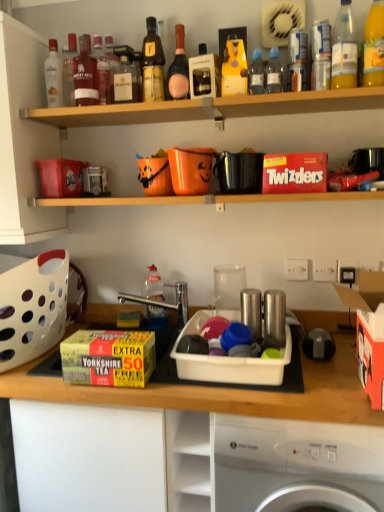
Question: Is translucent plastic bottle at upper right, the 12th bottle when ordered from left to right, to the right of yellow plastic bottle at upper center, the sixth bottle positioned from the right, from the viewer's perspective?

Choices:
 (A) no
 (B) yes

Answer: (B)

Question: Is translucent plastic bottle at upper right, the 12th bottle when ordered from left to right, positioned in front of yellow plastic bottle at upper center, the sixth bottle positioned from the right?

Choices:
 (A) yes
 (B) no

Answer: (A)

Question: From a real-world perspective, is translucent plastic bottle at upper right, which is the first bottle in right-to-left order, on yellow plastic bottle at upper center, arranged as the 7th bottle when viewed from the left?

Choices:
 (A) yes
 (B) no

Answer: (A)

Question: Does translucent plastic bottle at upper right, the 12th bottle when ordered from left to right, have a larger size compared to yellow plastic bottle at upper center, the sixth bottle positioned from the right?

Choices:
 (A) no
 (B) yes

Answer: (A)

Question: Does translucent plastic bottle at upper right, the 12th bottle when ordered from left to right, have a greater width compared to yellow plastic bottle at upper center, the sixth bottle positioned from the right?

Choices:
 (A) yes
 (B) no

Answer: (B)

Question: Can you confirm if translucent plastic bottle at upper right, which is the first bottle in right-to-left order, is thinner than yellow plastic bottle at upper center, arranged as the 7th bottle when viewed from the left?

Choices:
 (A) no
 (B) yes

Answer: (B)

Question: Can you confirm if matte plastic box at left, acting as the third box starting from the front, is thinner than clear plastic bottle at upper right, the second bottle in the right-to-left sequence?

Choices:
 (A) yes
 (B) no

Answer: (B)

Question: Can you confirm if matte plastic box at left, placed as the 3th box when sorted from right to left, is positioned to the left of clear plastic bottle at upper right, the second bottle in the right-to-left sequence?

Choices:
 (A) no
 (B) yes

Answer: (B)

Question: From the image's perspective, would you say matte plastic box at left, which is counted as the first box, starting from the top, is positioned over clear plastic bottle at upper right, the second bottle in the right-to-left sequence?

Choices:
 (A) yes
 (B) no

Answer: (B)

Question: From a real-world perspective, does matte plastic box at left, placed as the 3th box when sorted from right to left, stand above clear plastic bottle at upper right, the eleventh bottle viewed from the left?

Choices:
 (A) yes
 (B) no

Answer: (B)

Question: Considering the relative positions of matte plastic box at left, which is counted as the first box, starting from the top, and clear plastic bottle at upper right, the second bottle in the right-to-left sequence, in the image provided, is matte plastic box at left, which is counted as the first box, starting from the top, behind clear plastic bottle at upper right, the second bottle in the right-to-left sequence,?

Choices:
 (A) yes
 (B) no

Answer: (A)

Question: Does matte plastic box at left, which is counted as the first box, starting from the top, have a greater width compared to clear plastic bottle at upper right, the second bottle in the right-to-left sequence?

Choices:
 (A) yes
 (B) no

Answer: (A)

Question: Considering the relative sizes of pink glass bottle at upper center, arranged as the seventh bottle when viewed from the right, and translucent plastic bottle at upper right, the 12th bottle when ordered from left to right, in the image provided, is pink glass bottle at upper center, arranged as the seventh bottle when viewed from the right, smaller than translucent plastic bottle at upper right, the 12th bottle when ordered from left to right,?

Choices:
 (A) no
 (B) yes

Answer: (A)